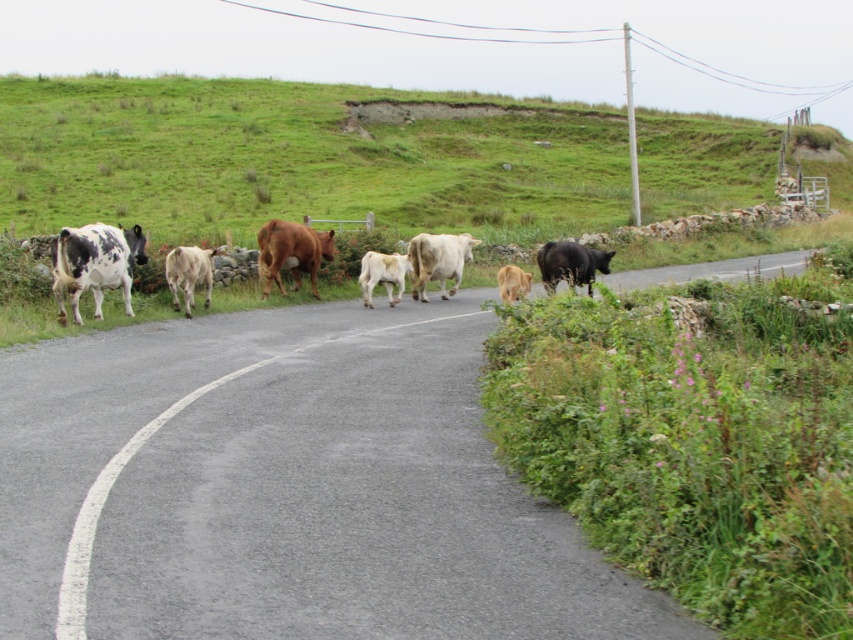
Is white smooth cow at center to the left of black glossy cow at right from the viewer's perspective?

Correct, you'll find white smooth cow at center to the left of black glossy cow at right.

Between point (444, 275) and point (585, 273), which one is positioned in front?

Point (585, 273)

Is point (469, 246) more distant than point (606, 259)?

Yes.

The height and width of the screenshot is (640, 853). What are the coordinates of `white smooth cow at center` in the screenshot? It's located at (438, 260).

Does green grassy hillside at upper left have a greater height compared to white glossy calf at center?

Yes, green grassy hillside at upper left is taller than white glossy calf at center.

Who is positioned more to the right, green grassy hillside at upper left or white glossy calf at center?

green grassy hillside at upper left

Between point (293, 102) and point (193, 253), which one is positioned behind?

The point (293, 102) is more distant.

What are the coordinates of `green grassy hillside at upper left` in the screenshot? It's located at 291,160.

Does white and black spotted cow at center appear on the right side of white glossy calf at center?

Correct, you'll find white and black spotted cow at center to the right of white glossy calf at center.

Is the position of white and black spotted cow at center less distant than that of white glossy calf at center?

Yes, white and black spotted cow at center is closer to the viewer.

I want to click on white and black spotted cow at center, so click(x=94, y=262).